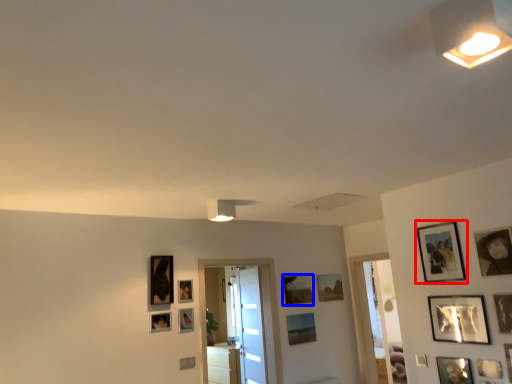
Question: Which of the following is the farthest to the observer, picture frame (highlighted by a red box) or picture frame (highlighted by a blue box)?

Choices:
 (A) picture frame
 (B) picture frame

Answer: (B)